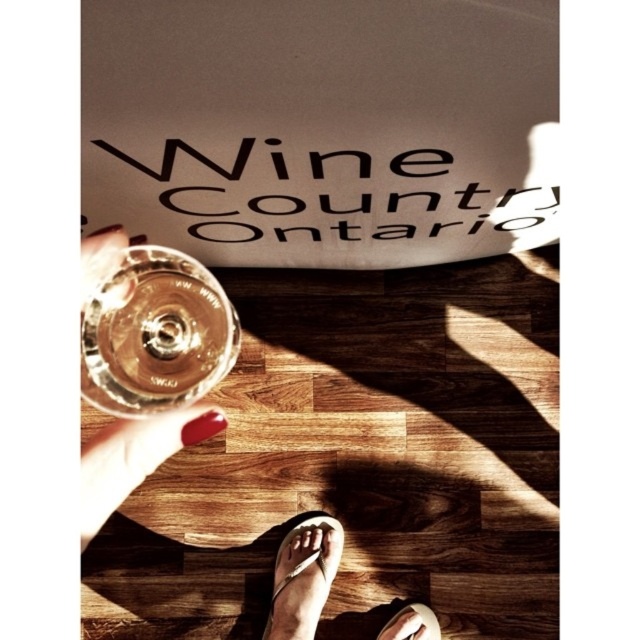
Who is positioned more to the right, white flip-flops at lower center or white flip-flop at lower center?

white flip-flops at lower center is more to the right.

Is point (134, 426) positioned after point (275, 557)?

No, it is not.

Locate an element on the screen. The height and width of the screenshot is (640, 640). white flip-flops at lower center is located at coordinates (134, 458).

Does white flip-flops at lower center have a lesser height compared to white leather sandal at lower center?

No, white flip-flops at lower center is not shorter than white leather sandal at lower center.

Between white flip-flops at lower center and white leather sandal at lower center, which one is positioned lower?

white leather sandal at lower center

Identify the location of white flip-flops at lower center. This screenshot has width=640, height=640. (134, 458).

Identify the location of white flip-flops at lower center. This screenshot has width=640, height=640. tap(134, 458).

Is clear glass wine glass at center to the left of white flip-flops at lower center from the viewer's perspective?

Yes, clear glass wine glass at center is to the left of white flip-flops at lower center.

Describe the element at coordinates (156, 333) in the screenshot. The height and width of the screenshot is (640, 640). I see `clear glass wine glass at center` at that location.

This screenshot has height=640, width=640. Find the location of `clear glass wine glass at center`. clear glass wine glass at center is located at coordinates (156, 333).